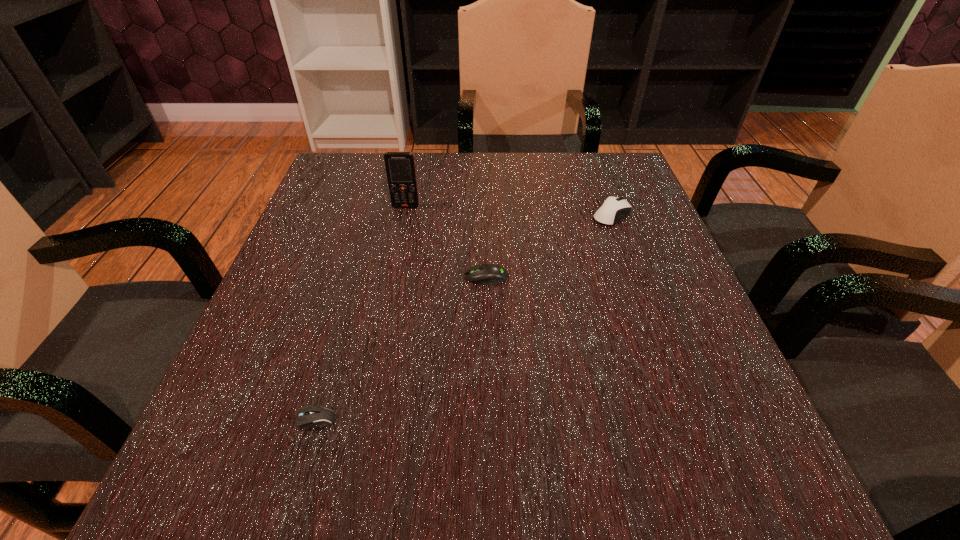
Where is `object present at the far right corner`? This screenshot has width=960, height=540. object present at the far right corner is located at coordinates (613, 209).

In the image, there is a desktop. Where is `free space at the far edge`? free space at the far edge is located at coordinates (492, 157).

At what (x,y) coordinates should I click in order to perform the action: click on vacant space at the left edge of the desktop. Please return your answer as a coordinate pair (x, y). The image size is (960, 540). Looking at the image, I should click on (306, 370).

The width and height of the screenshot is (960, 540). Identify the location of vacant space at the right edge of the desktop. (752, 413).

In the image, there is a desktop. At what (x,y) coordinates should I click in order to perform the action: click on free space at the far left corner. Please return your answer as a coordinate pair (x, y). This screenshot has height=540, width=960. Looking at the image, I should click on (346, 187).

The height and width of the screenshot is (540, 960). In the image, there is a desktop. In order to click on vacant area at the far right corner in this screenshot , I will do `click(620, 174)`.

The width and height of the screenshot is (960, 540). Identify the location of vacant region between the rightmost computer mouse and the cellular telephone. (509, 211).

At what (x,y) coordinates should I click in order to perform the action: click on vacant region between the rightmost computer mouse and the third object from right to left. Please return your answer as a coordinate pair (x, y). This screenshot has width=960, height=540. Looking at the image, I should click on (509, 211).

Where is `unoccupied position between the shortest computer mouse and the rightmost object`? The width and height of the screenshot is (960, 540). unoccupied position between the shortest computer mouse and the rightmost object is located at coordinates (456, 326).

The width and height of the screenshot is (960, 540). Identify the location of vacant space that is in between the farthest computer mouse and the cellular telephone. (509, 211).